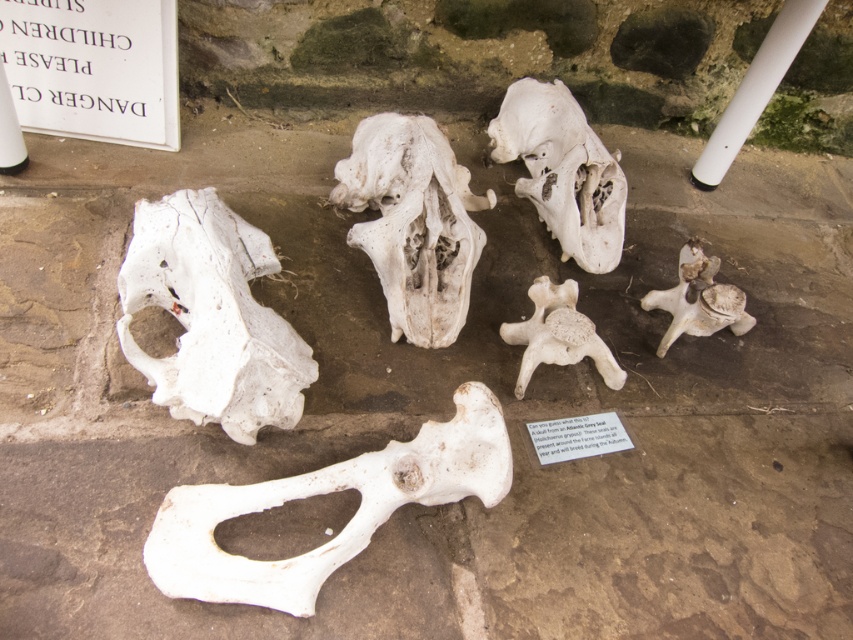
You are a parent at the exhibit and want to ensure your child stays away from the DANGER area mentioned on the sign. The white matte skull at left and white bone at center are near the warning. Which object is closer to the DANGER sign on the left side of the frame?

The white matte skull at left is closer to the DANGER sign on the left side of the frame because it is positioned to the left of the white bone at center, which places it nearer to the sign located on the left side of the frame.

Looking at this image, you are a museum guide explaining the skeletal remains to a group of students. You point to the white porous bone at center and the white porous skull at upper center. Which one do you tell them is taller?

The white porous bone at center is much taller than the white porous skull at upper center.